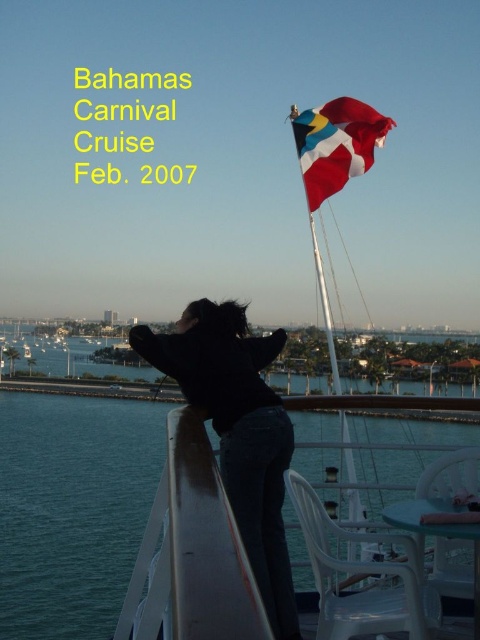
Is white plastic boat at upper center further to the viewer compared to black matte jacket at center?

No.

Who is lower down, white plastic boat at upper center or black matte jacket at center?

black matte jacket at center is lower down.

Between point (325, 109) and point (285, 548), which one is positioned in front?

Point (285, 548) is in front.

At what (x,y) coordinates should I click in order to perform the action: click on white plastic boat at upper center. Please return your answer as a coordinate pair (x, y). The width and height of the screenshot is (480, 640). Looking at the image, I should click on (189, 369).

Is black matte jacket at center thinner than red fabric flag at upper center?

Correct, black matte jacket at center's width is less than red fabric flag at upper center's.

In the scene shown: Is black matte jacket at center bigger than red fabric flag at upper center?

Incorrect, black matte jacket at center is not larger than red fabric flag at upper center.

Is point (272, 513) more distant than point (340, 99)?

No, it is not.

The width and height of the screenshot is (480, 640). Identify the location of black matte jacket at center. (238, 432).

Who is lower down, blue water at lower left or black matte jacket at center?

blue water at lower left is lower down.

Who is positioned more to the left, blue water at lower left or black matte jacket at center?

black matte jacket at center is more to the left.

Who is more forward, (142, 492) or (251, 365)?

Point (251, 365) is more forward.

Locate an element on the screen. The image size is (480, 640). blue water at lower left is located at coordinates (113, 518).